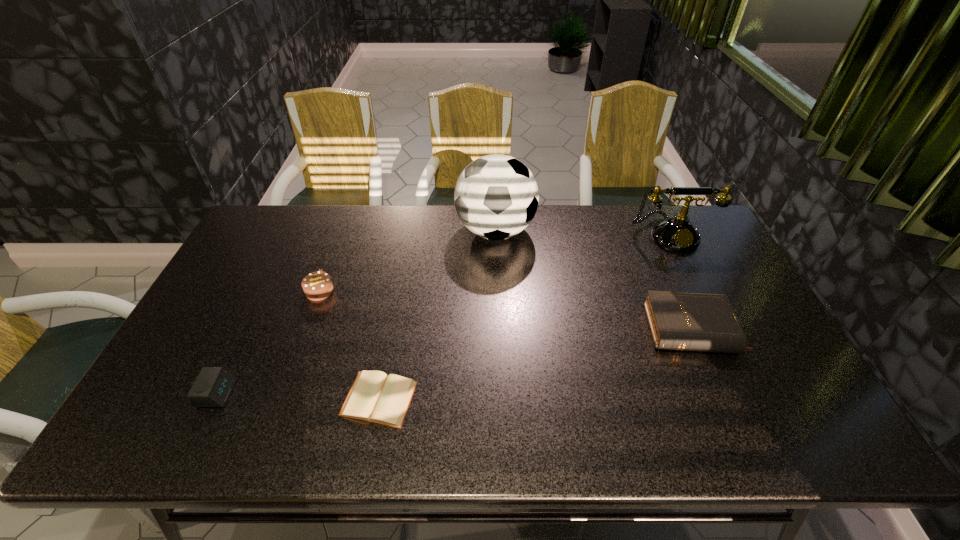
I want to click on object that is at the left edge, so click(x=213, y=385).

Identify the location of telephone located at the right edge. (677, 233).

I want to click on Bible located at the right edge, so click(x=691, y=321).

Image resolution: width=960 pixels, height=540 pixels. I want to click on object present at the far right corner, so click(x=677, y=233).

The width and height of the screenshot is (960, 540). Find the location of `vacant space at the far edge`. vacant space at the far edge is located at coordinates (573, 231).

In the image, there is a desktop. Identify the location of free space at the near edge. (384, 447).

Where is `free region at the left edge of the desktop`? The height and width of the screenshot is (540, 960). free region at the left edge of the desktop is located at coordinates (199, 325).

Where is `vacant space at the far right corner of the desktop`? This screenshot has height=540, width=960. vacant space at the far right corner of the desktop is located at coordinates (659, 219).

The height and width of the screenshot is (540, 960). In the image, there is a desktop. In order to click on free space at the near right corner in this screenshot , I will do `click(790, 426)`.

Find the location of a particular element. empty space that is in between the chocolate cake and the third object from right to left is located at coordinates (407, 261).